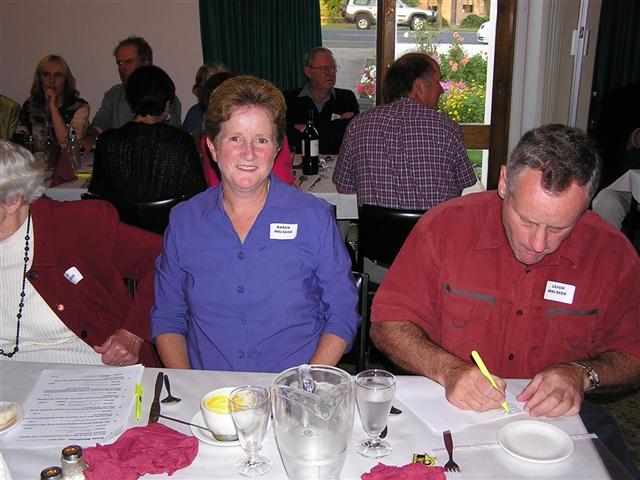
The image size is (640, 480). I want to click on wine bottle, so click(313, 148).